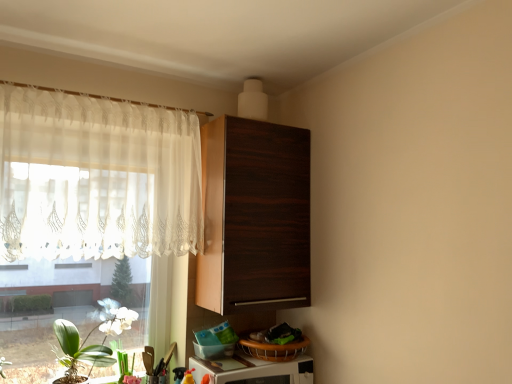
Question: From a real-world perspective, is green leafy plant at lower left positioned above or below white glossy microwave at lower center?

Choices:
 (A) below
 (B) above

Answer: (B)

Question: Is green leafy plant at lower left to the left or to the right of white glossy microwave at lower center in the image?

Choices:
 (A) right
 (B) left

Answer: (B)

Question: Which is farther from the green matte plant at lower left?

Choices:
 (A) dark wood cabinet at upper center
 (B) white glossy microwave at lower center
 (C) sheer white curtain at left
 (D) green leafy plant at lower left

Answer: (A)

Question: Estimate the real-world distances between objects in this image. Which object is closer to the green leafy plant at lower left?

Choices:
 (A) green matte plant at lower left
 (B) white glossy microwave at lower center
 (C) dark wood cabinet at upper center
 (D) sheer white curtain at left

Answer: (A)